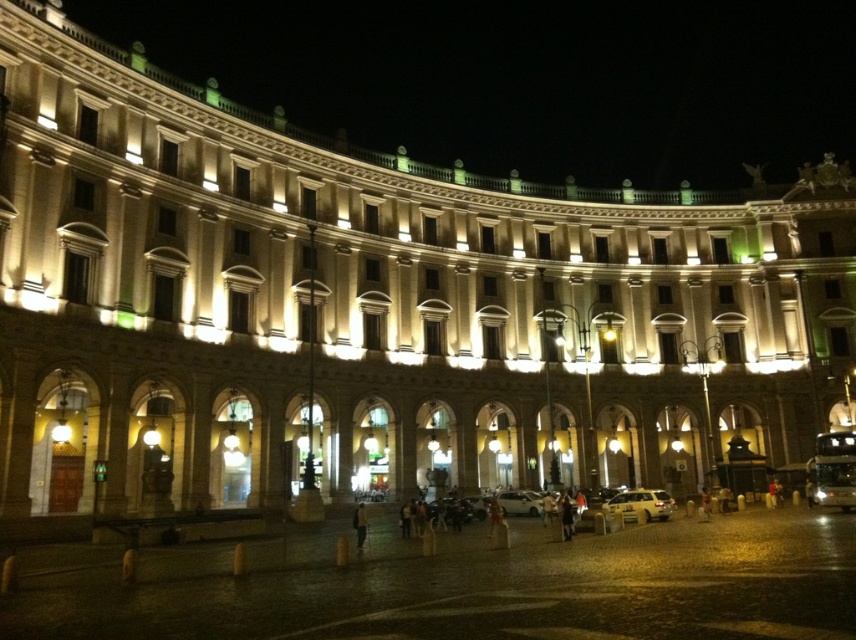
You are standing at the entrance of the building and want to park your car in the closest available spot. The parking spots are marked at coordinates ranging from 0.6 to 0.9 on the x and y axes. Is the yellow metallic car at lower right parked within the designated parking area?

The yellow metallic car at lower right is parked at coordinates point (x=642, y=502), which falls within the designated parking area ranging from 0.6 to 0.9 on both axes. Therefore, the car is properly parked within the designated area.

You are standing in front of the building and want to determine the relative positions of two points marked on its facade. The points are labeled as point 1 at coordinates point (672, 500) and point 2 at coordinates point (541, 513). Which point is closer to you?

Point 1 at coordinates point (672, 500) is closer to you because it is further to the viewer than point 2 at coordinates point (541, 513).